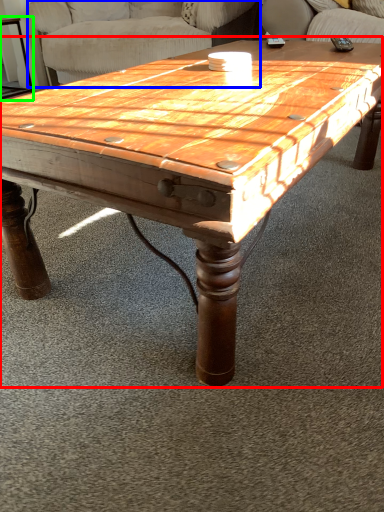
Question: Estimate the real-world distances between objects in this image. Which object is closer to coffee table (highlighted by a red box), swivel chair (highlighted by a blue box) or side table (highlighted by a green box)?

Choices:
 (A) swivel chair
 (B) side table

Answer: (A)